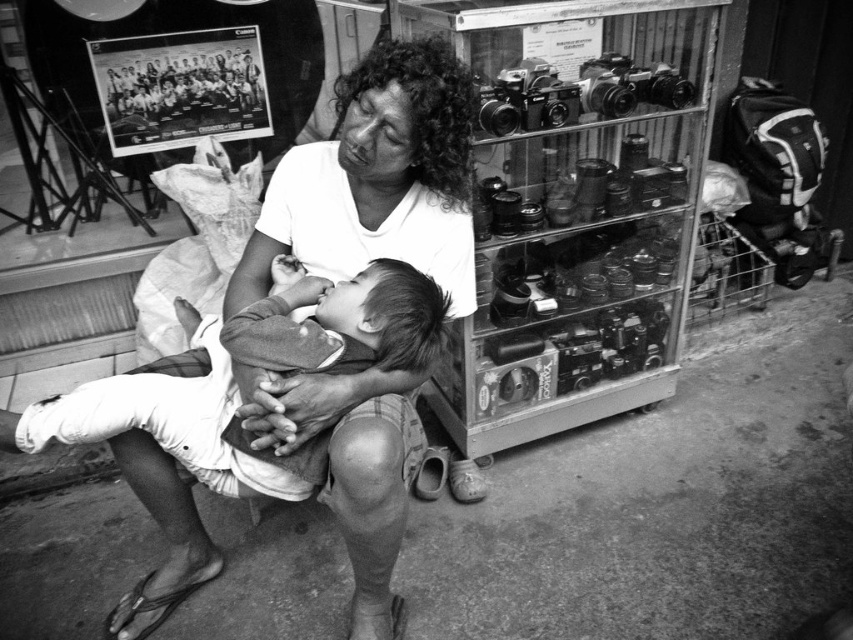
Question: Which object appears closest to the camera in this image?

Choices:
 (A) white cotton shirt at center
 (B) soft cotton baby at center

Answer: (A)

Question: Observing the image, what is the correct spatial positioning of white cotton shirt at center in reference to soft cotton baby at center?

Choices:
 (A) below
 (B) above

Answer: (B)

Question: Does white cotton shirt at center appear under soft cotton baby at center?

Choices:
 (A) no
 (B) yes

Answer: (A)

Question: Which point is closer to the camera?

Choices:
 (A) soft cotton baby at center
 (B) white cotton shirt at center

Answer: (B)

Question: Which object is farther from the camera taking this photo?

Choices:
 (A) soft cotton baby at center
 (B) white cotton shirt at center

Answer: (A)

Question: Considering the relative positions of white cotton shirt at center and soft cotton baby at center in the image provided, where is white cotton shirt at center located with respect to soft cotton baby at center?

Choices:
 (A) above
 (B) below

Answer: (A)